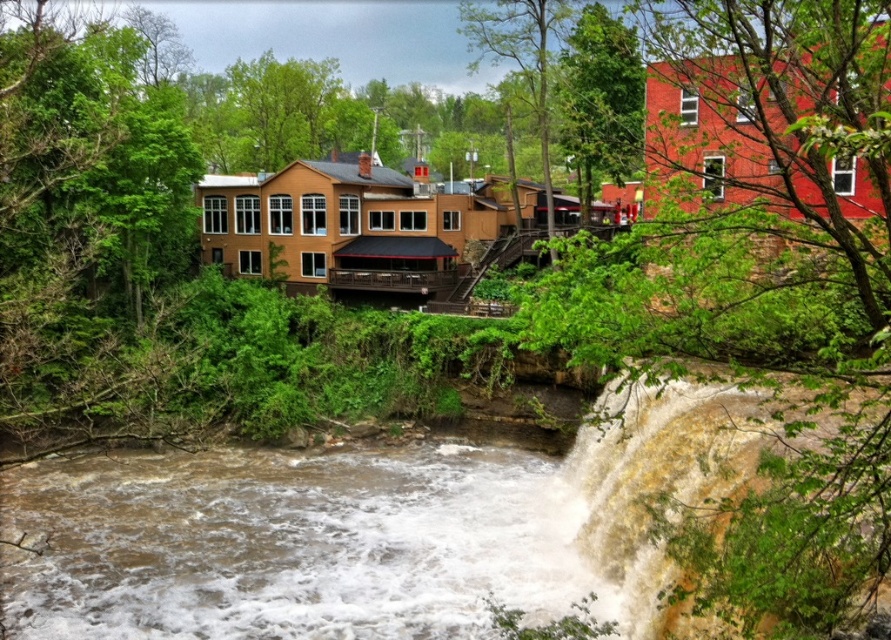
Question: Among these points, which one is nearest to the camera?

Choices:
 (A) (846, 225)
 (B) (48, 547)

Answer: (A)

Question: Is green leafy tree at upper right positioned behind brown muddy water at lower center?

Choices:
 (A) yes
 (B) no

Answer: (B)

Question: Can you confirm if green leafy tree at upper right is positioned to the left of brown muddy water at lower center?

Choices:
 (A) yes
 (B) no

Answer: (B)

Question: Can you confirm if green leafy tree at upper right is bigger than brown muddy water at lower center?

Choices:
 (A) no
 (B) yes

Answer: (B)